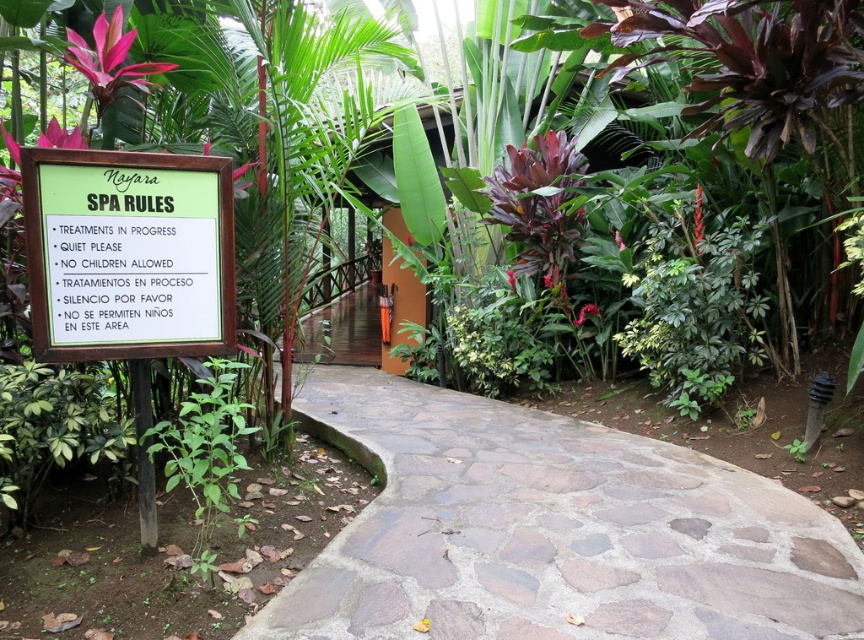
Can you confirm if green wooden sign at upper left is taller than green leafy plant at lower left?

No, green wooden sign at upper left is not taller than green leafy plant at lower left.

Between point (29, 218) and point (182, 458), which one is positioned behind?

The point (182, 458) is more distant.

This screenshot has width=864, height=640. I want to click on green wooden sign at upper left, so click(128, 253).

You are a GUI agent. You are given a task and a screenshot of the screen. Output one action in this format:
    pyautogui.click(x=<x>, y=<y>)
    Task: Click on the green wooden sign at upper left
    
    Given the screenshot: What is the action you would take?
    pyautogui.click(x=128, y=253)

Which is behind, point (417, 529) or point (205, 416)?

Positioned behind is point (417, 529).

Is natural stone pathway at center further to the viewer compared to green leafy plant at lower left?

Yes, natural stone pathway at center is behind green leafy plant at lower left.

Measure the distance between point [403,452] and camera.

Point [403,452] is 4.89 meters away from camera.

In order to click on natural stone pathway at center in this screenshot , I will do `click(551, 531)`.

Can you confirm if natural stone pathway at center is wider than green wooden sign at upper left?

Yes.

Who is positioned more to the left, natural stone pathway at center or green wooden sign at upper left?

green wooden sign at upper left is more to the left.

Is point (484, 404) closer to camera compared to point (35, 221)?

No, it is not.

Where is `natural stone pathway at center`? natural stone pathway at center is located at coordinates (551, 531).